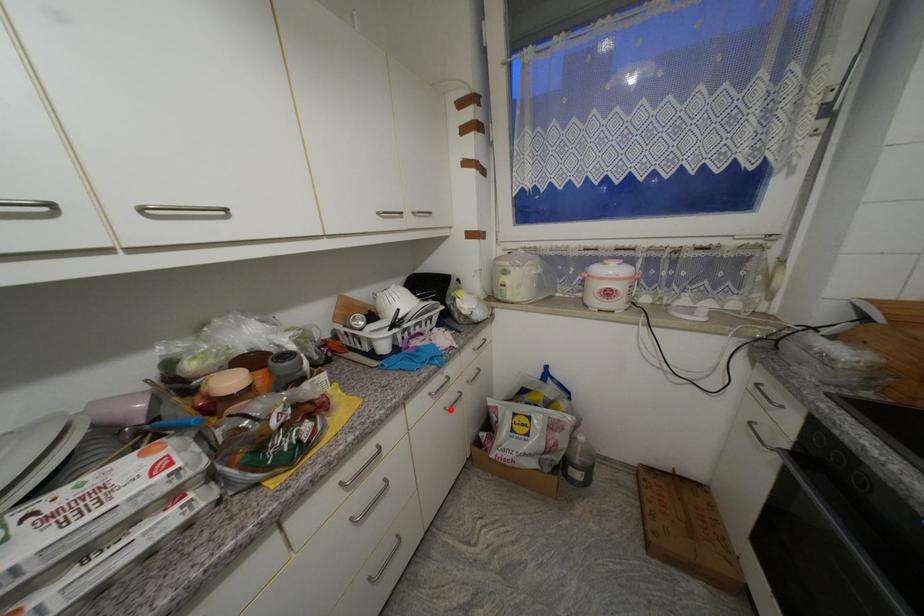
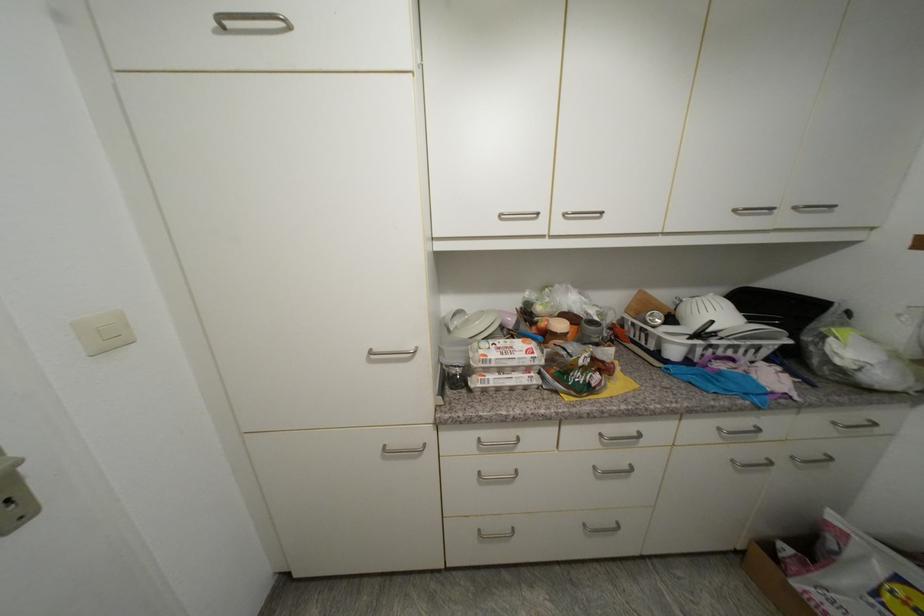
Where in the second image is the point corresponding to the highlighted location from the first image?

(738, 463)